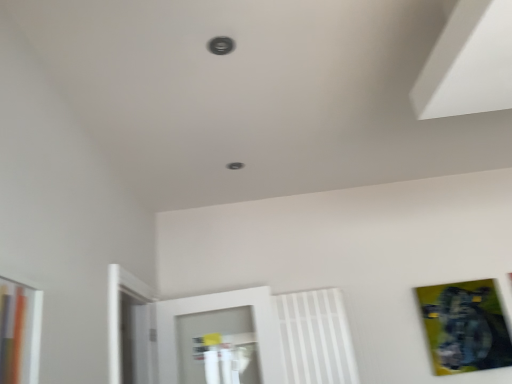
Question: Is metallic circular hole at center, marked as the 2th hole in a top-to-bottom arrangement, far from metallic circular hole at upper center, acting as the 1th hole starting from the front?

Choices:
 (A) no
 (B) yes

Answer: (B)

Question: Is metallic circular hole at center, which is counted as the first hole, starting from the back, not inside metallic circular hole at upper center, marked as the first hole in a top-to-bottom arrangement?

Choices:
 (A) yes
 (B) no

Answer: (A)

Question: Considering the relative positions of metallic circular hole at center, placed as the 1th hole when sorted from bottom to top, and metallic circular hole at upper center, which appears as the second hole when ordered from the bottom, in the image provided, is metallic circular hole at center, placed as the 1th hole when sorted from bottom to top, in front of metallic circular hole at upper center, which appears as the second hole when ordered from the bottom,?

Choices:
 (A) yes
 (B) no

Answer: (B)

Question: Could metallic circular hole at upper center, which appears as the second hole when ordered from the bottom, be considered to be inside metallic circular hole at center, marked as the 2th hole in a top-to-bottom arrangement?

Choices:
 (A) no
 (B) yes

Answer: (A)

Question: From the image's perspective, would you say metallic circular hole at center, which is counted as the first hole, starting from the back, is positioned over metallic circular hole at upper center, which appears as the second hole when ordered from the bottom?

Choices:
 (A) yes
 (B) no

Answer: (B)

Question: Is metallic circular hole at upper center, acting as the 1th hole starting from the front, inside the boundaries of metallic gold picture frame at lower right, or outside?

Choices:
 (A) inside
 (B) outside

Answer: (B)

Question: From their relative heights in the image, would you say metallic circular hole at upper center, positioned as the second hole in back-to-front order, is taller or shorter than metallic gold picture frame at lower right?

Choices:
 (A) short
 (B) tall

Answer: (A)

Question: In the image, is metallic circular hole at upper center, acting as the 1th hole starting from the front, positioned in front of or behind metallic gold picture frame at lower right?

Choices:
 (A) behind
 (B) front

Answer: (B)

Question: From the image's perspective, is metallic circular hole at upper center, acting as the 1th hole starting from the front, positioned above or below metallic gold picture frame at lower right?

Choices:
 (A) above
 (B) below

Answer: (A)

Question: Is point (440, 332) positioned closer to the camera than point (287, 327)?

Choices:
 (A) farther
 (B) closer

Answer: (A)

Question: From their relative heights in the image, would you say metallic gold picture frame at lower right is taller or shorter than white plastic radiator at center?

Choices:
 (A) tall
 (B) short

Answer: (B)

Question: From the image's perspective, is metallic gold picture frame at lower right located above or below white plastic radiator at center?

Choices:
 (A) below
 (B) above

Answer: (B)

Question: Looking at the image, does metallic gold picture frame at lower right seem bigger or smaller compared to white plastic radiator at center?

Choices:
 (A) small
 (B) big

Answer: (A)

Question: From a real-world perspective, is white plastic radiator at center above or below metallic circular hole at center, which is counted as the second hole, starting from the front?

Choices:
 (A) above
 (B) below

Answer: (B)

Question: Is point (292, 314) positioned closer to the camera than point (226, 163)?

Choices:
 (A) farther
 (B) closer

Answer: (A)